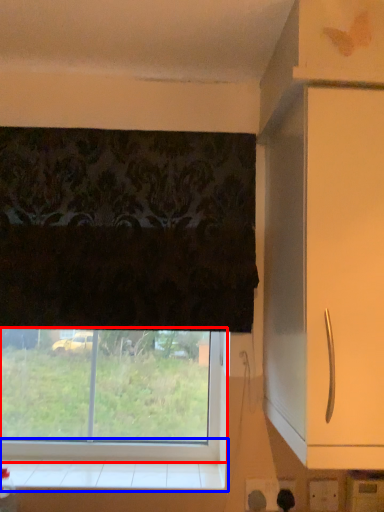
Question: Which object appears closest to the camera in this image, window (highlighted by a red box) or window sill (highlighted by a blue box)?

Choices:
 (A) window
 (B) window sill

Answer: (B)